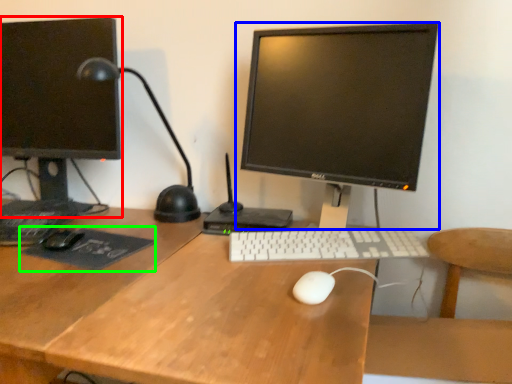
Question: Which object is positioned closest to computer monitor (highlighted by a red box)? Select from computer monitor (highlighted by a blue box) and mousepad (highlighted by a green box).

Choices:
 (A) computer monitor
 (B) mousepad

Answer: (B)